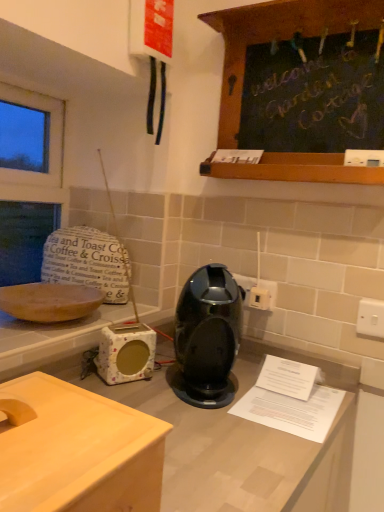
Question: Is the position of glossy plastic coffee machine at center more distant than that of floral-patterned ceramic toaster at lower left?

Choices:
 (A) no
 (B) yes

Answer: (A)

Question: Is glossy plastic coffee machine at center at the left side of floral-patterned ceramic toaster at lower left?

Choices:
 (A) no
 (B) yes

Answer: (A)

Question: Can you confirm if glossy plastic coffee machine at center is taller than floral-patterned ceramic toaster at lower left?

Choices:
 (A) no
 (B) yes

Answer: (B)

Question: From the image's perspective, is glossy plastic coffee machine at center above floral-patterned ceramic toaster at lower left?

Choices:
 (A) yes
 (B) no

Answer: (A)

Question: From a real-world perspective, is glossy plastic coffee machine at center under floral-patterned ceramic toaster at lower left?

Choices:
 (A) no
 (B) yes

Answer: (A)

Question: Considering the relative sizes of glossy plastic coffee machine at center and floral-patterned ceramic toaster at lower left in the image provided, is glossy plastic coffee machine at center bigger than floral-patterned ceramic toaster at lower left?

Choices:
 (A) no
 (B) yes

Answer: (B)

Question: Would you say matte wooden bowl at left contains glossy plastic coffee machine at center?

Choices:
 (A) no
 (B) yes

Answer: (A)

Question: Does matte wooden bowl at left appear on the left side of glossy plastic coffee machine at center?

Choices:
 (A) yes
 (B) no

Answer: (A)

Question: Is matte wooden bowl at left wider than glossy plastic coffee machine at center?

Choices:
 (A) no
 (B) yes

Answer: (B)

Question: From a real-world perspective, is matte wooden bowl at left located higher than glossy plastic coffee machine at center?

Choices:
 (A) no
 (B) yes

Answer: (A)

Question: Is matte wooden bowl at left located outside glossy plastic coffee machine at center?

Choices:
 (A) yes
 (B) no

Answer: (A)

Question: Is matte wooden bowl at left smaller than glossy plastic coffee machine at center?

Choices:
 (A) yes
 (B) no

Answer: (A)

Question: From a real-world perspective, is matte wooden bowl at left on top of white plastic electric outlet at center-right, which is the 1th electric outlet from back to front?

Choices:
 (A) no
 (B) yes

Answer: (A)